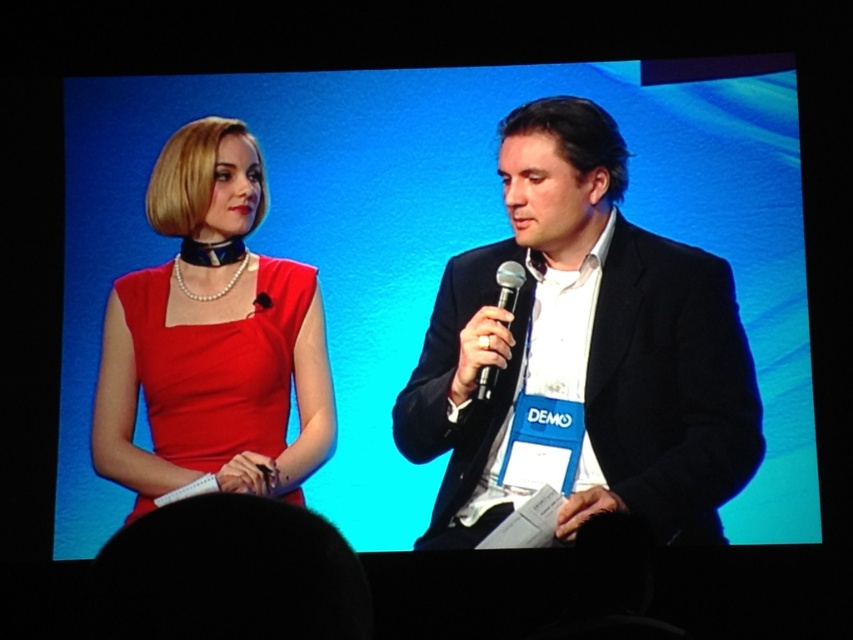
Based on the coordinates provided, which object is located at point (585, 348)?

The black matte suit at center is located at point (585, 348).

You are organizing an event and need to choose a microphone that can be seen from the back of the room. Based on the image, which microphone between the matte black microphone at center and the black metallic microphone at center is taller and thus more visible?

The matte black microphone at center is much taller than the black metallic microphone at center, so it would be more visible from the back of the room.

You are designing a virtual reality setup and need to place a virtual microphone in the exact same position as the matte black microphone at center in the image. What are the coordinates where you should place the virtual microphone?

The coordinates for the matte black microphone at center are at point (437, 248), so you should place the virtual microphone at those coordinates.